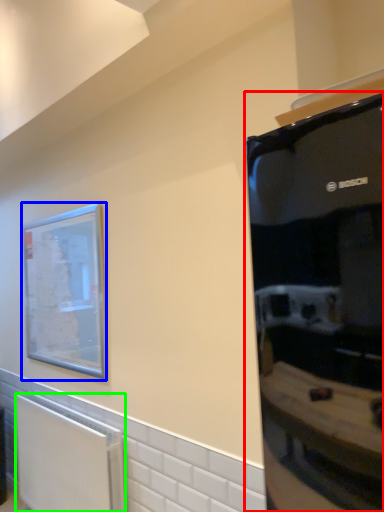
Question: Estimate the real-world distances between objects in this image. Which object is closer to appliance (highlighted by a red box), picture frame (highlighted by a blue box) or radiator (highlighted by a green box)?

Choices:
 (A) picture frame
 (B) radiator

Answer: (A)